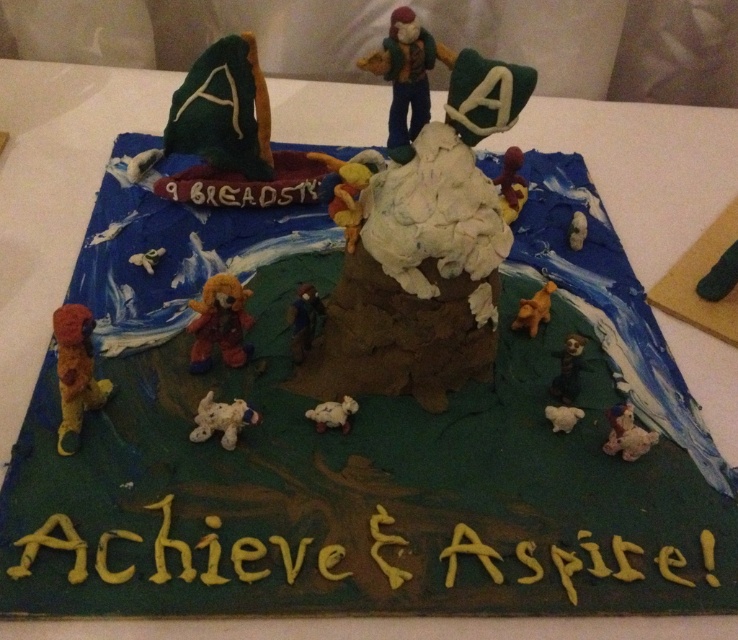
You are a cake decorator who needs to place a small flag on the cake. The flag requires at least 2 inches of space to the right of both the white fluffy teddy bear at lower right and the white plastic dog at lower right. Is there enough space available on the cake for the flag?

The white fluffy teddy bear at lower right might be wider than the white plastic dog at lower right, so the space to the right of both could be insufficient. Check the width of the teddy bear to ensure there is enough space for the flag.

You are a guest at a birthday party and see the white plush dog at lower center and the white plastic dog at lower right on the adventure themed cake. Which dog is bigger?

The white plush dog at lower center is larger in size than the white plastic dog at lower right.

You are a cake decorator who needs to place a small flag between the white fluffy teddy bear at lower right and the white plastic dog at lower right. Can you fit the flag if it requires 5 centimeters of space?

The white fluffy teddy bear at lower right and white plastic dog at lower right are 5.24 centimeters apart from each other. Since the flag requires 5 centimeters of space, there is enough room to place it between them.